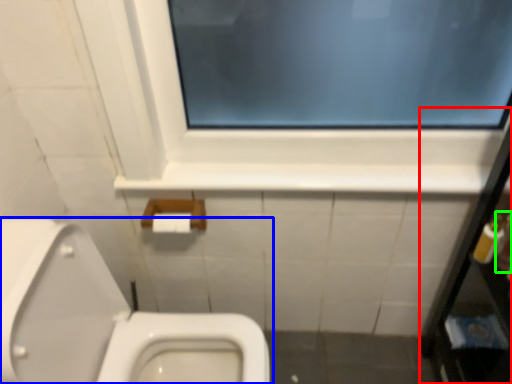
Question: Considering the real-world distances, which object is farthest from medicine cabinet (highlighted by a red box)? toilet (highlighted by a blue box) or toiletry (highlighted by a green box)?

Choices:
 (A) toilet
 (B) toiletry

Answer: (A)